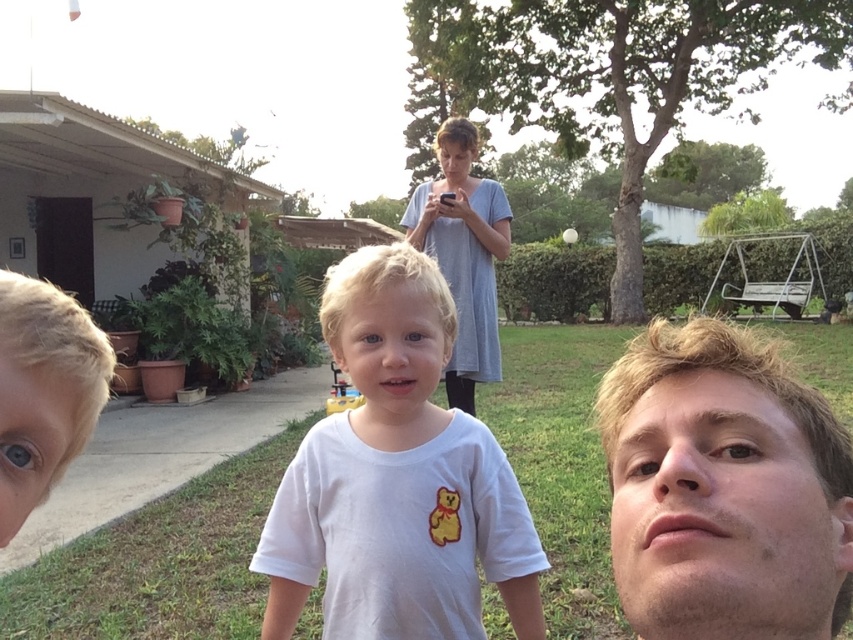
You are a photographer trying to capture the smooth skin face at lower right. The camera you are using has a focus point at coordinate point (724, 486). Will the focus point align with the subject?

Yes, the smooth skin face at lower right is located at point (724, 486), so the focus point will align with the subject.